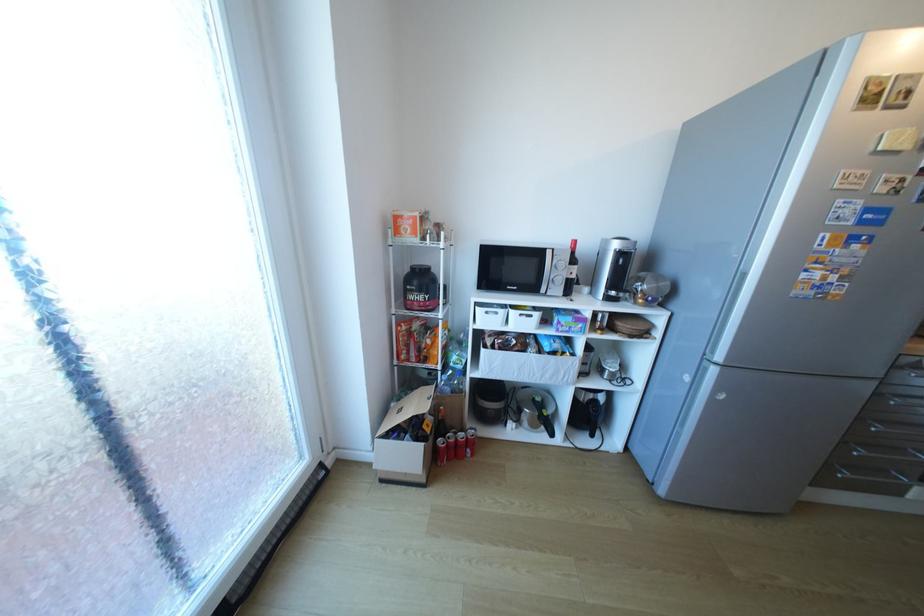
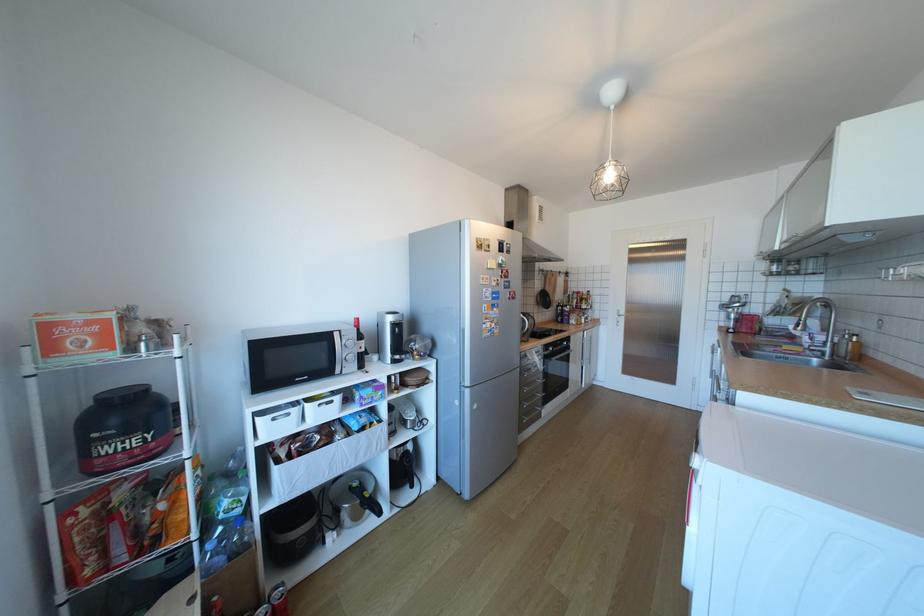
Where in the second image is the point corresponding to [564,257] from the first image?

(351, 337)